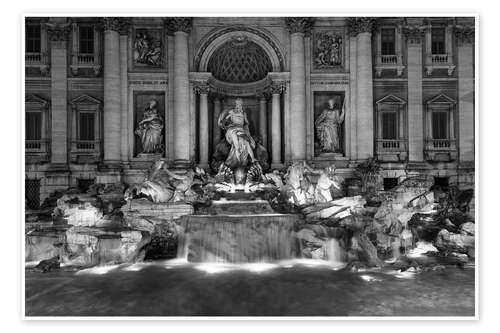
Where is `statue`? The image size is (500, 333). statue is located at coordinates (236, 135).